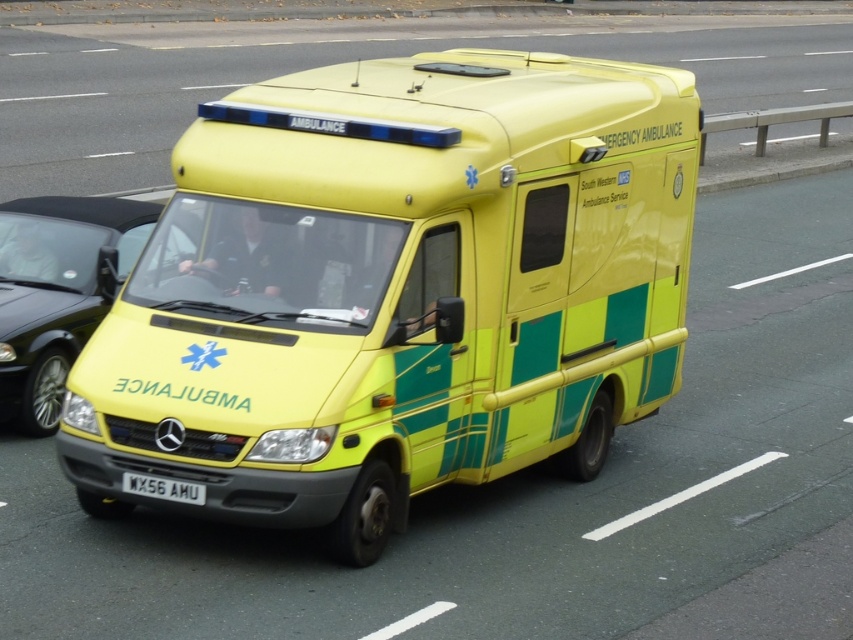
Question: Is yellow/green plastic ambulance at center further to the viewer compared to white plastic license plate at center?

Choices:
 (A) no
 (B) yes

Answer: (B)

Question: Estimate the real-world distances between objects in this image. Which object is farther from the white plastic license plate at center?

Choices:
 (A) yellow matte ambulance at center
 (B) yellow/green plastic ambulance at center

Answer: (A)

Question: Is yellow matte ambulance at center bigger than white plastic license plate at center?

Choices:
 (A) no
 (B) yes

Answer: (B)

Question: Which point is closer to the camera?

Choices:
 (A) (9, 202)
 (B) (143, 481)

Answer: (B)

Question: Which object is the farthest from the yellow/green plastic ambulance at center?

Choices:
 (A) yellow matte ambulance at center
 (B) white plastic license plate at center

Answer: (A)

Question: Is yellow matte ambulance at center behind white plastic license plate at center?

Choices:
 (A) yes
 (B) no

Answer: (A)